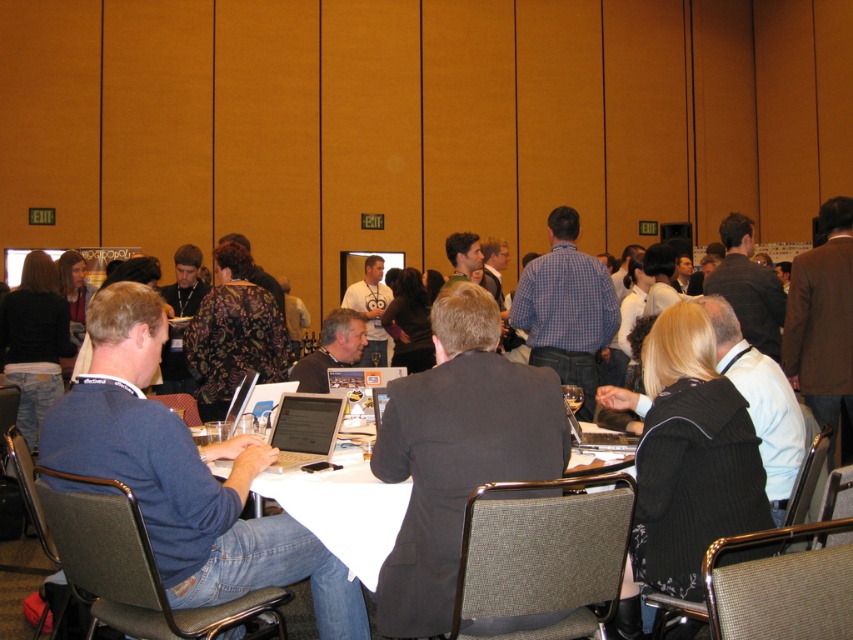
You are organizing a photo shoot in this conference room and need to place a large prop that requires a significant amount of space. You have two options for placement locations based on the objects in the scene. Which object, the matte black jacket at center or the metallic gray chair at lower left, would you choose to position the prop next to, considering their sizes?

The matte black jacket at center has a larger size compared to the metallic gray chair at lower left, so you should position the prop next to the matte black jacket at center to accommodate its size requirements.

You are standing in the conference room and want to find the point at coordinates [344,509]. According to the scene description, where would this point be located?

The point at coordinates [344,509] is located on the white paper at center.

You are attending a professional meeting and need to locate your belongings. You remember placing your matte black jacket at center near your seat, which is a metallic gray chair at lower left. Based on the scene description, can you determine the position of your jacket relative to your chair?

The matte black jacket at center is to the right of the metallic gray chair at lower left, so your jacket is positioned to the right side of your chair.